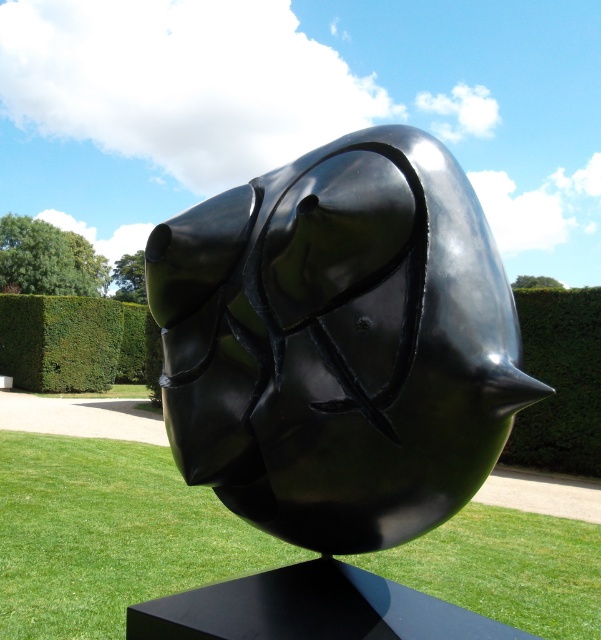
Question: Which point appears farthest from the camera in this image?

Choices:
 (A) (87, 326)
 (B) (153, 596)
 (C) (584, 464)

Answer: (A)

Question: Which object is the farthest from the green leafy hedge at center?

Choices:
 (A) green grass at center
 (B) green hedge at right
 (C) glossy black sculpture at center

Answer: (C)

Question: Is glossy black sculpture at center closer to camera compared to green leafy hedge at center?

Choices:
 (A) yes
 (B) no

Answer: (A)

Question: Among these objects, which one is nearest to the camera?

Choices:
 (A) green leafy hedge at center
 (B) glossy black sculpture at center

Answer: (B)

Question: Can you confirm if glossy black sculpture at center is positioned above green leafy hedge at center?

Choices:
 (A) yes
 (B) no

Answer: (A)

Question: Does green grass at center have a lesser width compared to green hedge at right?

Choices:
 (A) no
 (B) yes

Answer: (B)